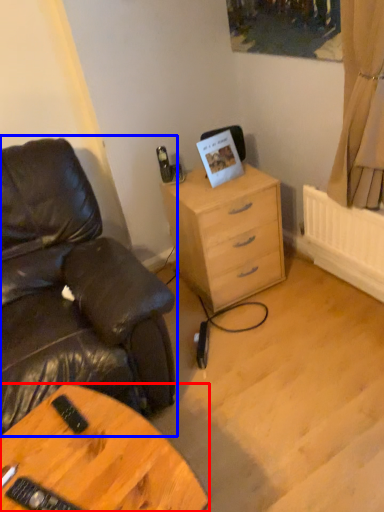
Question: Which object appears farthest to the camera in this image, desk (highlighted by a red box) or chair (highlighted by a blue box)?

Choices:
 (A) desk
 (B) chair

Answer: (B)